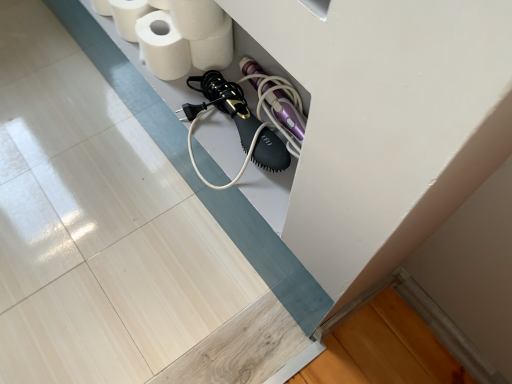
Question: Which direction should I rotate to look at white matte toilet paper at upper center, which is the fourth toilet paper from left to right, — up or down?

Choices:
 (A) up
 (B) down

Answer: (A)

Question: Which direction should I rotate to look at white matte toilet paper at upper center, which ranks as the 3th toilet paper in left-to-right order, — up or down?

Choices:
 (A) down
 (B) up

Answer: (B)

Question: Is white matte toilet paper at upper center, arranged as the 1th toilet paper when viewed from the right, outside of white matte toilet paper at upper left, which appears as the 4th toilet paper when viewed from the right?

Choices:
 (A) yes
 (B) no

Answer: (A)

Question: Is white matte toilet paper at upper center, which is the fourth toilet paper from left to right, closer to camera compared to white matte toilet paper at upper left, which appears as the 4th toilet paper when viewed from the right?

Choices:
 (A) yes
 (B) no

Answer: (A)

Question: Does white matte toilet paper at upper center, which is the fourth toilet paper from left to right, have a smaller size compared to white matte toilet paper at upper left, which appears as the 4th toilet paper when viewed from the right?

Choices:
 (A) no
 (B) yes

Answer: (B)

Question: From a real-world perspective, is white matte toilet paper at upper center, arranged as the 1th toilet paper when viewed from the right, located beneath white matte toilet paper at upper left, positioned as the 1th toilet paper in left-to-right order?

Choices:
 (A) no
 (B) yes

Answer: (B)

Question: Is white matte toilet paper at upper center, which is the fourth toilet paper from left to right, thinner than white matte toilet paper at upper left, which appears as the 4th toilet paper when viewed from the right?

Choices:
 (A) yes
 (B) no

Answer: (A)

Question: Is white matte toilet paper at upper center, arranged as the 1th toilet paper when viewed from the right, facing away from white matte toilet paper at upper left, positioned as the 1th toilet paper in left-to-right order?

Choices:
 (A) no
 (B) yes

Answer: (A)

Question: From the image's perspective, is white matte toilet paper at upper left, positioned as the 1th toilet paper in left-to-right order, beneath white matte toilet paper at upper left, which ranks as the second toilet paper in left-to-right order?

Choices:
 (A) yes
 (B) no

Answer: (B)

Question: Is white matte toilet paper at upper left, which appears as the 4th toilet paper when viewed from the right, smaller than white matte toilet paper at upper left, which ranks as the second toilet paper in left-to-right order?

Choices:
 (A) yes
 (B) no

Answer: (A)

Question: Can white matte toilet paper at upper left, the 3th toilet paper positioned from the right, be found inside white matte toilet paper at upper left, positioned as the 1th toilet paper in left-to-right order?

Choices:
 (A) no
 (B) yes

Answer: (A)

Question: Does white matte toilet paper at upper left, which appears as the 4th toilet paper when viewed from the right, have a larger size compared to white matte toilet paper at upper left, the 3th toilet paper positioned from the right?

Choices:
 (A) no
 (B) yes

Answer: (A)

Question: Is white matte toilet paper at upper left, positioned as the 1th toilet paper in left-to-right order, to the left of white matte toilet paper at upper left, which ranks as the second toilet paper in left-to-right order, from the viewer's perspective?

Choices:
 (A) no
 (B) yes

Answer: (B)

Question: Does white matte toilet paper at upper left, which appears as the 4th toilet paper when viewed from the right, have a greater width compared to white matte toilet paper at upper left, which ranks as the second toilet paper in left-to-right order?

Choices:
 (A) yes
 (B) no

Answer: (B)

Question: Is white matte toilet paper at upper center, arranged as the 1th toilet paper when viewed from the right, in contact with white matte toilet paper at upper center, placed as the second toilet paper when sorted from right to left?

Choices:
 (A) yes
 (B) no

Answer: (A)